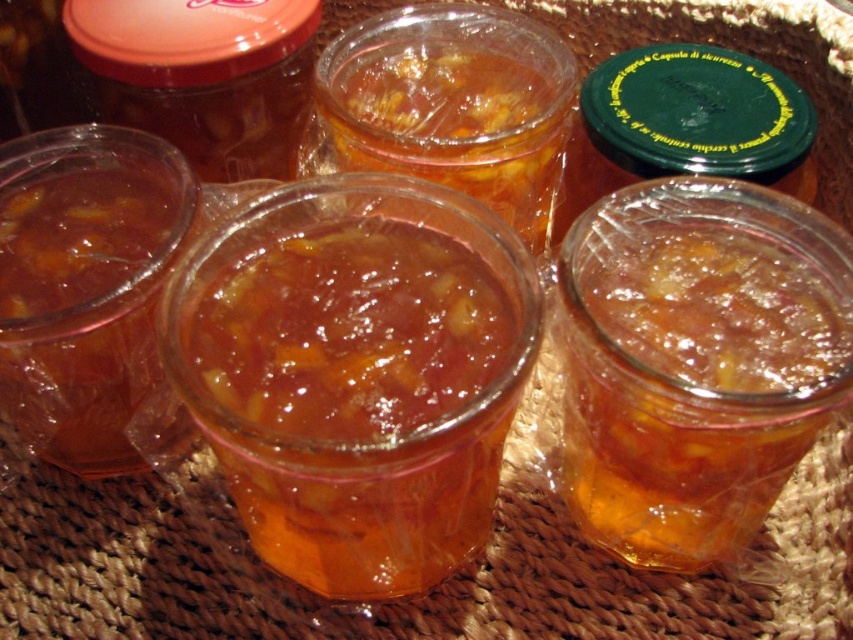
You are a customer at a farmers market and see two jars of jam, the translucent glass jam at center and the translucent amber jam at center. Which jar has a greater height?

The translucent glass jam at center is much taller than the translucent amber jam at center.